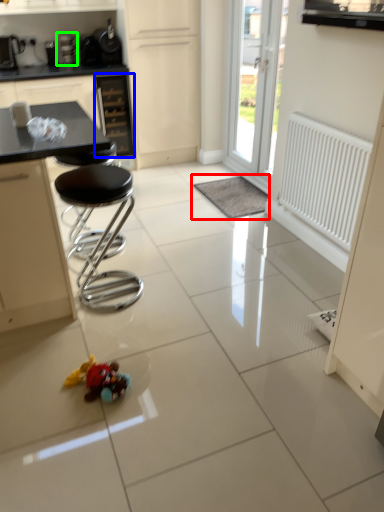
Question: Estimate the real-world distances between objects in this image. Which object is farther from wide (highlighted by a red box), drawer (highlighted by a blue box) or appliance (highlighted by a green box)?

Choices:
 (A) drawer
 (B) appliance

Answer: (B)